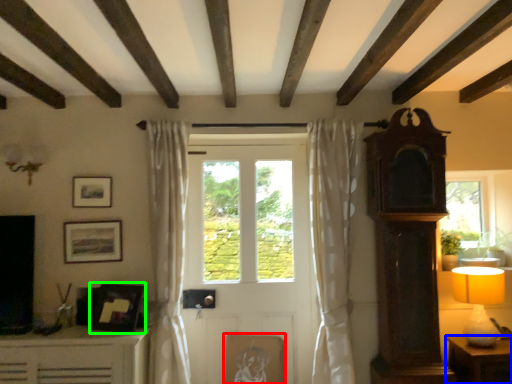
Question: Based on their relative distances, which object is nearer to picture frame (highlighted by a red box)? Choose from table (highlighted by a blue box) and picture frame (highlighted by a green box).

Choices:
 (A) table
 (B) picture frame

Answer: (B)